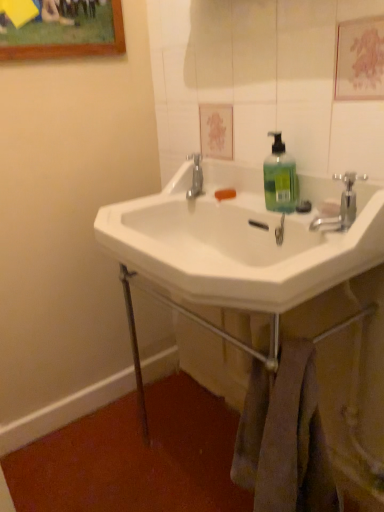
Question: Does green translucent liquid at center lie behind white glossy mirror at upper center?

Choices:
 (A) yes
 (B) no

Answer: (A)

Question: Is white glossy mirror at upper center inside green translucent liquid at center?

Choices:
 (A) yes
 (B) no

Answer: (B)

Question: From the image's perspective, does green translucent liquid at center appear lower than white glossy mirror at upper center?

Choices:
 (A) yes
 (B) no

Answer: (A)

Question: Is green translucent liquid at center placed right next to white glossy mirror at upper center?

Choices:
 (A) yes
 (B) no

Answer: (B)

Question: Is green translucent liquid at center not inside white glossy mirror at upper center?

Choices:
 (A) yes
 (B) no

Answer: (A)

Question: Is green translucent liquid at center taller than white glossy mirror at upper center?

Choices:
 (A) yes
 (B) no

Answer: (B)

Question: Is green translucent liquid at center positioned behind white ceramic sink at center?

Choices:
 (A) yes
 (B) no

Answer: (A)

Question: Is white ceramic sink at center inside green translucent liquid at center?

Choices:
 (A) yes
 (B) no

Answer: (B)

Question: Is green translucent liquid at center placed right next to white ceramic sink at center?

Choices:
 (A) no
 (B) yes

Answer: (A)

Question: Is green translucent liquid at center positioned before white ceramic sink at center?

Choices:
 (A) yes
 (B) no

Answer: (B)

Question: Could you tell me if green translucent liquid at center is turned towards white ceramic sink at center?

Choices:
 (A) yes
 (B) no

Answer: (A)

Question: From a real-world perspective, is green translucent liquid at center physically above white ceramic sink at center?

Choices:
 (A) no
 (B) yes

Answer: (B)

Question: Is white glossy mirror at upper center not inside chrome metallic faucet at upper right?

Choices:
 (A) no
 (B) yes

Answer: (B)